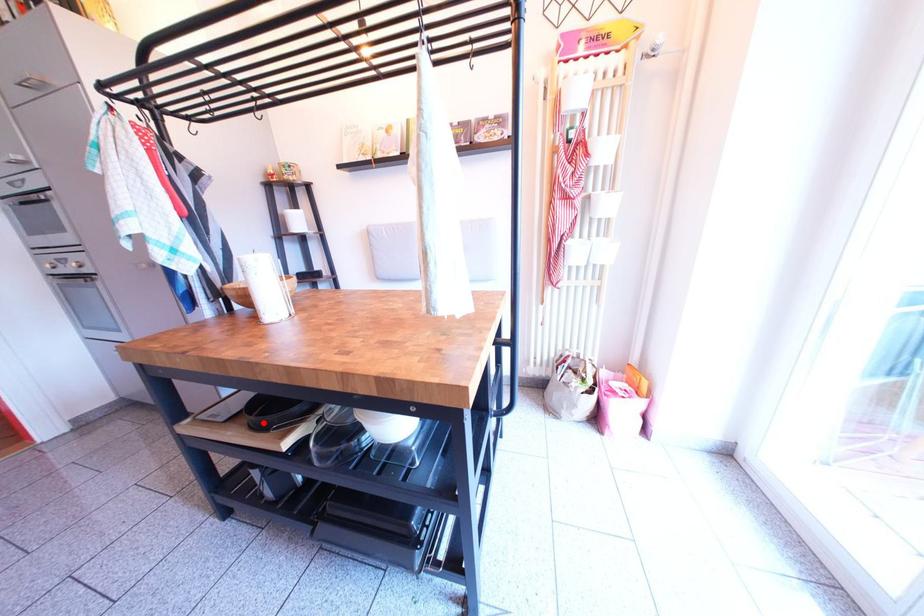
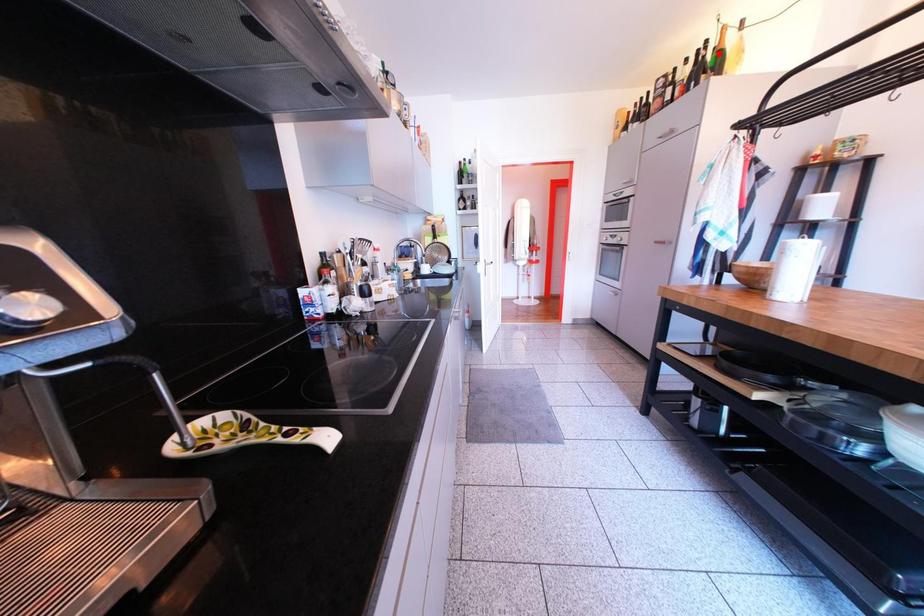
I am providing you with two images of the same scene from different viewpoints. A red point is marked on the first image and another point is marked on the second image. Does the point marked in image1 correspond to the same location as the one in image2?

No